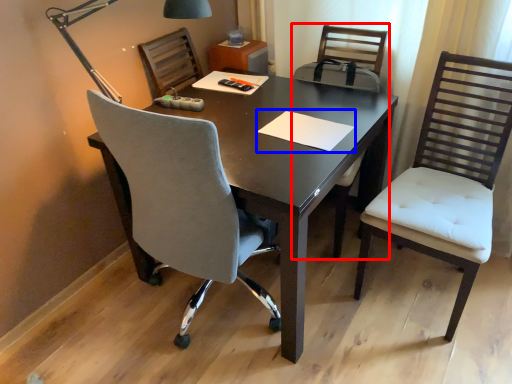
Question: Among these objects, which one is farthest to the camera, armchair (highlighted by a red box) or notepad (highlighted by a blue box)?

Choices:
 (A) armchair
 (B) notepad

Answer: (A)